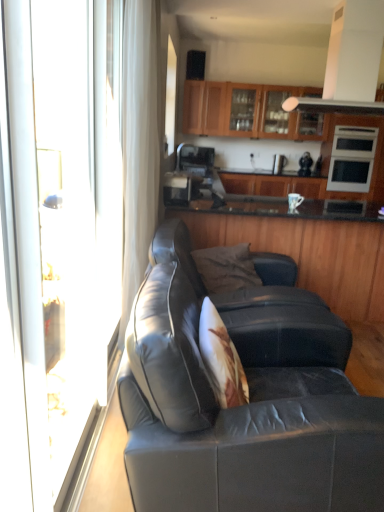
You are a GUI agent. You are given a task and a screenshot of the screen. Output one action in this format:
    pyautogui.click(x=<x>, y=<y>)
    Task: Click on the metallic silver coffee maker at center, the 1th appliance positioned from the back
    This screenshot has width=384, height=512.
    Given the screenshot: What is the action you would take?
    pyautogui.click(x=278, y=164)

I want to click on matte brown cabinets at center, marked as the 2th cabinetry in a top-to-bottom arrangement, so click(272, 185).

This screenshot has width=384, height=512. Find the location of `transparent glass screen door at left`. transparent glass screen door at left is located at coordinates (58, 234).

Find the location of a particular element. The width and height of the screenshot is (384, 512). matte black leather couch at center is located at coordinates (245, 405).

Measure the distance between satin black coffee machine at center, marked as the 1th appliance in a front-to-back arrangement, and camera.

satin black coffee machine at center, marked as the 1th appliance in a front-to-back arrangement, and camera are 10.40 feet apart from each other.

Locate an element on the screen. This screenshot has width=384, height=512. satin black toaster at center, marked as the 3th appliance in a right-to-left arrangement is located at coordinates (195, 159).

Where is `metallic silver coffee maker at center, which is counted as the fourth appliance, starting from the front`? This screenshot has height=512, width=384. metallic silver coffee maker at center, which is counted as the fourth appliance, starting from the front is located at coordinates (278, 164).

Is matte black leather couch at center taller than metallic silver coffee maker at center, which is counted as the fourth appliance, starting from the front?

Yes, matte black leather couch at center is taller than metallic silver coffee maker at center, which is counted as the fourth appliance, starting from the front.

Is point (187, 365) in front of point (283, 158)?

Yes, it is.

Is matte black leather couch at center positioned before metallic silver coffee maker at center, the 2th appliance when ordered from right to left?

Yes, matte black leather couch at center is closer to the camera.

Is matte black leather couch at center to the left or to the right of metallic silver coffee maker at center, the 1th appliance positioned from the back, in the image?

matte black leather couch at center is to the left of metallic silver coffee maker at center, the 1th appliance positioned from the back.

Does metallic silver coffee maker at center, which is counted as the fourth appliance, starting from the front, contain wooden cabinet at center, arranged as the third cabinetry when viewed from the top?

That's incorrect, wooden cabinet at center, arranged as the third cabinetry when viewed from the top, is not inside metallic silver coffee maker at center, which is counted as the fourth appliance, starting from the front.

Is metallic silver coffee maker at center, which is counted as the fourth appliance, starting from the front, smaller than wooden cabinet at center, placed as the first cabinetry when sorted from bottom to top?

Indeed, metallic silver coffee maker at center, which is counted as the fourth appliance, starting from the front, has a smaller size compared to wooden cabinet at center, placed as the first cabinetry when sorted from bottom to top.

From the picture: Is metallic silver coffee maker at center, the 2th appliance when ordered from right to left, facing away from wooden cabinet at center, arranged as the third cabinetry when viewed from the top?

metallic silver coffee maker at center, the 2th appliance when ordered from right to left, does not have its back to wooden cabinet at center, arranged as the third cabinetry when viewed from the top.

From the picture: Which of these two, metallic silver coffee maker at center, placed as the third appliance when sorted from left to right, or wooden cabinet at center, placed as the first cabinetry when sorted from bottom to top, is thinner?

metallic silver coffee maker at center, placed as the third appliance when sorted from left to right.

In the scene shown: Is satin black toaster at center, marked as the second appliance in a back-to-front arrangement, at the back of satin black coffee machine at center, positioned as the 4th appliance in back-to-front order?

No, satin black toaster at center, marked as the second appliance in a back-to-front arrangement, is not at the back of satin black coffee machine at center, positioned as the 4th appliance in back-to-front order.

Where is `the 2nd appliance located above the satin black coffee machine at center, marked as the 1th appliance in a front-to-back arrangement (from a real-world perspective)`? The height and width of the screenshot is (512, 384). the 2nd appliance located above the satin black coffee machine at center, marked as the 1th appliance in a front-to-back arrangement (from a real-world perspective) is located at coordinates [195, 159].

Are satin black coffee machine at center, marked as the 1th appliance in a front-to-back arrangement, and satin black toaster at center, the second appliance from the left, located far from each other?

Actually, satin black coffee machine at center, marked as the 1th appliance in a front-to-back arrangement, and satin black toaster at center, the second appliance from the left, are a little close together.

Is there a large distance between wooden cabinets at upper center, the first cabinetry in the top-to-bottom sequence, and satin black coffee machine at center, which is counted as the 4th appliance, starting from the right?

Yes, wooden cabinets at upper center, the first cabinetry in the top-to-bottom sequence, and satin black coffee machine at center, which is counted as the 4th appliance, starting from the right, are quite far apart.

Is wooden cabinets at upper center, the third cabinetry ordered from the bottom, inside the boundaries of satin black coffee machine at center, which is counted as the 4th appliance, starting from the right, or outside?

wooden cabinets at upper center, the third cabinetry ordered from the bottom, is located beyond the bounds of satin black coffee machine at center, which is counted as the 4th appliance, starting from the right.

Would you say wooden cabinets at upper center, the first cabinetry in the top-to-bottom sequence, is to the left or to the right of satin black coffee machine at center, positioned as the 4th appliance in back-to-front order, in the picture?

Clearly, wooden cabinets at upper center, the first cabinetry in the top-to-bottom sequence, is on the right of satin black coffee machine at center, positioned as the 4th appliance in back-to-front order, in the image.

The height and width of the screenshot is (512, 384). I want to click on the 2nd appliance counting from the left side of the wooden cabinets at upper center, the third cabinetry ordered from the bottom, so click(180, 187).

In terms of height, does satin black coffee machine at center, which is counted as the first appliance, starting from the left, look taller or shorter compared to matte black leather couch at center?

In the image, satin black coffee machine at center, which is counted as the first appliance, starting from the left, appears to be shorter than matte black leather couch at center.

Is the depth of satin black coffee machine at center, which is counted as the first appliance, starting from the left, greater than that of matte black leather couch at center?

That is True.

Which of these two, satin black coffee machine at center, marked as the 1th appliance in a front-to-back arrangement, or matte black leather couch at center, is thinner?

satin black coffee machine at center, marked as the 1th appliance in a front-to-back arrangement.

Which is more to the left, satin black coffee machine at center, which is counted as the first appliance, starting from the left, or matte black leather couch at center?

satin black coffee machine at center, which is counted as the first appliance, starting from the left.

Considering the positions of objects matte black leather couch at center and white sheer curtain at upper left in the image provided, who is more to the right, matte black leather couch at center or white sheer curtain at upper left?

matte black leather couch at center is more to the right.

From the image's perspective, which one is positioned lower, matte black leather couch at center or white sheer curtain at upper left?

matte black leather couch at center.

Consider the image. Can you tell me how much matte black leather couch at center and white sheer curtain at upper left differ in facing direction?

They differ by 2.55 degrees in their facing directions.

Could you tell me if matte black leather couch at center is turned towards white sheer curtain at upper left?

No, matte black leather couch at center is not aimed at white sheer curtain at upper left.

Could you tell me if satin silver microwave at upper right, the 3th appliance positioned from the back, is turned towards satin black toaster at center, the second appliance from the left?

No, satin silver microwave at upper right, the 3th appliance positioned from the back, does not turn towards satin black toaster at center, the second appliance from the left.

From a real-world perspective, is satin silver microwave at upper right, the 3th appliance positioned from the back, physically located above or below satin black toaster at center, the second appliance from the left?

From a real-world perspective, satin silver microwave at upper right, the 3th appliance positioned from the back, is physically above satin black toaster at center, the second appliance from the left.

Considering the sizes of objects satin silver microwave at upper right, placed as the second appliance when sorted from front to back, and satin black toaster at center, marked as the second appliance in a back-to-front arrangement, in the image provided, who is thinner, satin silver microwave at upper right, placed as the second appliance when sorted from front to back, or satin black toaster at center, marked as the second appliance in a back-to-front arrangement,?

satin black toaster at center, marked as the second appliance in a back-to-front arrangement.

Are satin silver microwave at upper right, which ranks as the fourth appliance in left-to-right order, and satin black toaster at center, the second appliance from the left, located far from each other?

Yes, satin silver microwave at upper right, which ranks as the fourth appliance in left-to-right order, and satin black toaster at center, the second appliance from the left, are quite far apart.

The height and width of the screenshot is (512, 384). I want to click on studio couch to the left of metallic silver coffee maker at center, which is counted as the fourth appliance, starting from the front, so click(x=245, y=405).

The image size is (384, 512). Find the location of `the 2nd appliance above the wooden cabinet at center, placed as the first cabinetry when sorted from bottom to top (from the image's perspective)`. the 2nd appliance above the wooden cabinet at center, placed as the first cabinetry when sorted from bottom to top (from the image's perspective) is located at coordinates (278, 164).

From the image, which object appears to be farther from satin black coffee machine at center, which is counted as the 4th appliance, starting from the right, wooden cabinets at upper center, the first cabinetry in the top-to-bottom sequence, or wooden cabinet at center, arranged as the third cabinetry when viewed from the top?

wooden cabinets at upper center, the first cabinetry in the top-to-bottom sequence, lies further to satin black coffee machine at center, which is counted as the 4th appliance, starting from the right, than the other object.

From the image, which object appears to be farther from satin black coffee machine at center, which is counted as the first appliance, starting from the left, satin silver microwave at upper right, placed as the second appliance when sorted from front to back, or matte brown cabinets at center, marked as the 2th cabinetry in a top-to-bottom arrangement?

satin silver microwave at upper right, placed as the second appliance when sorted from front to back, is further to satin black coffee machine at center, which is counted as the first appliance, starting from the left.

When comparing their distances from satin black coffee machine at center, positioned as the 4th appliance in back-to-front order, does metallic silver coffee maker at center, placed as the third appliance when sorted from left to right, or matte black leather couch at center seem further?

matte black leather couch at center.

Looking at the image, which one is located closer to transparent glass screen door at left, satin silver microwave at upper right, the 3th appliance positioned from the back, or matte brown cabinets at center, which is counted as the 2th cabinetry, starting from the bottom?

satin silver microwave at upper right, the 3th appliance positioned from the back, is closer to transparent glass screen door at left.

Considering their positions, is satin black toaster at center, marked as the second appliance in a back-to-front arrangement, positioned further to metallic silver coffee maker at center, placed as the third appliance when sorted from left to right, than wooden cabinets at upper center, the third cabinetry ordered from the bottom?

Among the two, satin black toaster at center, marked as the second appliance in a back-to-front arrangement, is located further to metallic silver coffee maker at center, placed as the third appliance when sorted from left to right.

Which object lies nearer to the anchor point satin black coffee machine at center, marked as the 1th appliance in a front-to-back arrangement, dark gray fabric pillow at center or white sheer curtain at upper left?

white sheer curtain at upper left lies closer to satin black coffee machine at center, marked as the 1th appliance in a front-to-back arrangement, than the other object.

Based on their spatial positions, is dark gray fabric pillow at center or metallic silver coffee maker at center, placed as the third appliance when sorted from left to right, further from satin silver microwave at upper right, which ranks as the fourth appliance in left-to-right order?

Based on the image, dark gray fabric pillow at center appears to be further to satin silver microwave at upper right, which ranks as the fourth appliance in left-to-right order.

When comparing their distances from matte brown cabinets at center, which is counted as the 2th cabinetry, starting from the bottom, does transparent glass screen door at left or satin silver microwave at upper right, which ranks as the fourth appliance in left-to-right order, seem closer?

satin silver microwave at upper right, which ranks as the fourth appliance in left-to-right order.

The height and width of the screenshot is (512, 384). What are the coordinates of `appliance between wooden cabinets at upper center, the third cabinetry ordered from the bottom, and satin silver microwave at upper right, the 3th appliance positioned from the back, in the horizontal direction` in the screenshot? It's located at (278, 164).

Find the location of `studio couch between transparent glass screen door at left and metallic silver coffee maker at center, which is counted as the fourth appliance, starting from the front, in the front-back direction`. studio couch between transparent glass screen door at left and metallic silver coffee maker at center, which is counted as the fourth appliance, starting from the front, in the front-back direction is located at coordinates (245, 405).

At what (x,y) coordinates should I click in order to perform the action: click on appliance between white sheer curtain at upper left and satin silver microwave at upper right, which ranks as the fourth appliance in left-to-right order, from front to back. Please return your answer as a coordinate pair (x, y). Image resolution: width=384 pixels, height=512 pixels. Looking at the image, I should click on pyautogui.click(x=180, y=187).

The image size is (384, 512). In order to click on pillow located between white sheer curtain at upper left and satin black coffee machine at center, which is counted as the 4th appliance, starting from the right, in the depth direction in this screenshot , I will do `click(226, 268)`.